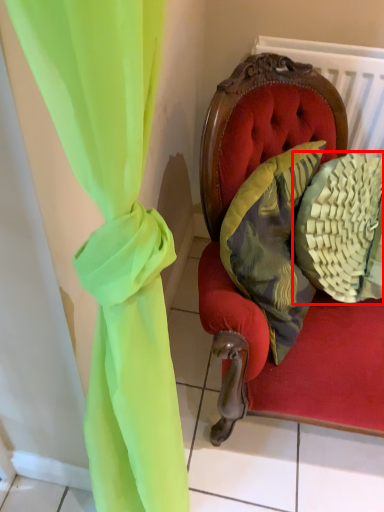
Question: From the image's perspective, where is pillow (annotated by the red box) located relative to pillow?

Choices:
 (A) below
 (B) above

Answer: (B)